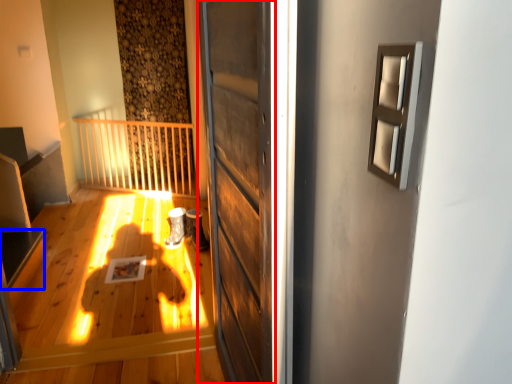
Question: Which of the following is the farthest to the observer, door (highlighted by a red box) or stairwell (highlighted by a blue box)?

Choices:
 (A) door
 (B) stairwell

Answer: (B)